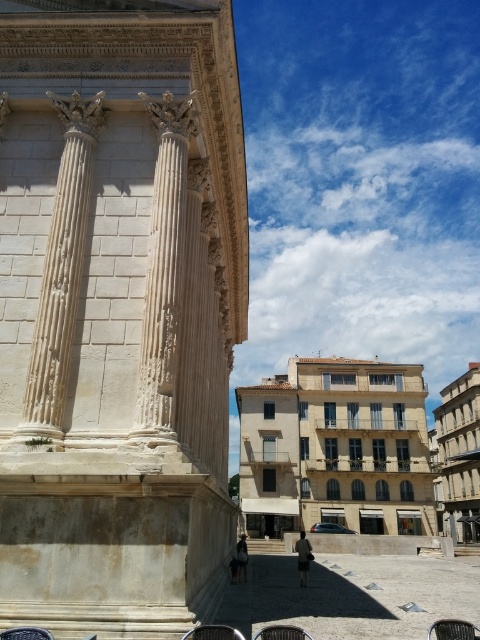
Question: Does white marble column at center appear on the right side of metallic mesh chair at lower center?

Choices:
 (A) yes
 (B) no

Answer: (B)

Question: Which point is farther from the camera taking this photo?

Choices:
 (A) (208, 637)
 (B) (153, 211)

Answer: (B)

Question: Does metallic mesh chair at lower center lie in front of brown woven chair at lower left?

Choices:
 (A) yes
 (B) no

Answer: (B)

Question: Among these points, which one is nearest to the camera?

Choices:
 (A) (148, 100)
 (B) (22, 630)

Answer: (B)

Question: Is white marble column at center to the right of black plastic chair at lower right from the viewer's perspective?

Choices:
 (A) no
 (B) yes

Answer: (A)

Question: Which object appears closest to the camera in this image?

Choices:
 (A) brown woven chair at lower left
 (B) metallic mesh chair at lower center
 (C) black plastic chair at lower right
 (D) white marble column at center

Answer: (A)